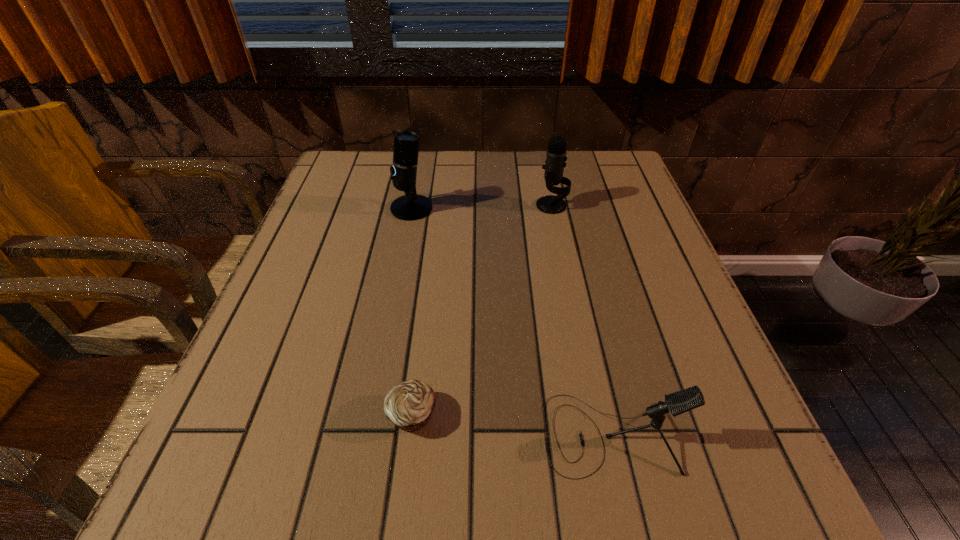
This screenshot has width=960, height=540. What are the coordinates of `the leftmost microphone` in the screenshot? It's located at (411, 206).

The image size is (960, 540). I want to click on the third tallest object, so click(679, 402).

The image size is (960, 540). Identify the location of the nearest microphone. (679, 402).

You are a GUI agent. You are given a task and a screenshot of the screen. Output one action in this format:
    pyautogui.click(x=<x>, y=<y>)
    Task: Click on the muffin
    
    Given the screenshot: What is the action you would take?
    pyautogui.click(x=409, y=405)

The image size is (960, 540). Find the location of `vacant space situated 0.230m on the front of the leftmost microphone`. vacant space situated 0.230m on the front of the leftmost microphone is located at coordinates pyautogui.click(x=396, y=288).

At what (x,y) coordinates should I click in order to perform the action: click on vacant space located on the stand of the nearest microphone. Please return your answer as a coordinate pair (x, y). Looking at the image, I should click on click(x=407, y=434).

Where is `free space located on the stand of the nearest microphone`? This screenshot has width=960, height=540. free space located on the stand of the nearest microphone is located at coordinates (316, 434).

Where is `free space located 0.210m on the stand of the nearest microphone`? The height and width of the screenshot is (540, 960). free space located 0.210m on the stand of the nearest microphone is located at coordinates (407, 434).

Locate an element on the screen. The width and height of the screenshot is (960, 540). blank space located 0.110m on the left of the muffin is located at coordinates (318, 415).

What are the coordinates of `object present at the near edge` in the screenshot? It's located at (679, 402).